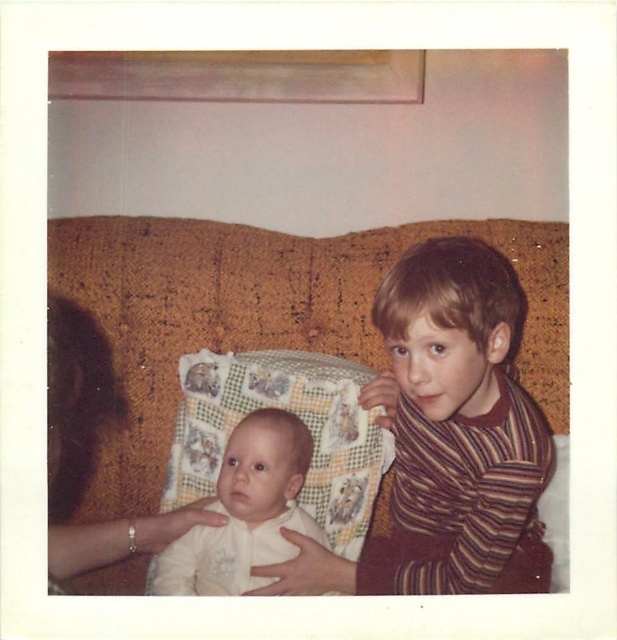
Question: Estimate the real-world distances between objects in this image. Which object is closer to the quilted fabric pillow at center?

Choices:
 (A) brown textured couch at center
 (B) striped knit sweater at right

Answer: (A)

Question: Which point is closer to the camera taking this photo?

Choices:
 (A) (48, 301)
 (B) (491, 282)
 (C) (275, 531)
 (D) (178, 496)

Answer: (B)

Question: Which of these objects is positioned closest to the brown textured couch at center?

Choices:
 (A) white soft fabric baby at center
 (B) smooth skin hand at lower left
 (C) striped knit sweater at right

Answer: (B)

Question: Does striped knit sweater at right have a larger size compared to white soft fabric baby at center?

Choices:
 (A) yes
 (B) no

Answer: (A)

Question: Can you confirm if brown textured couch at center is positioned to the left of quilted fabric pillow at center?

Choices:
 (A) yes
 (B) no

Answer: (B)

Question: Is striped knit sweater at right thinner than white soft fabric baby at center?

Choices:
 (A) no
 (B) yes

Answer: (A)